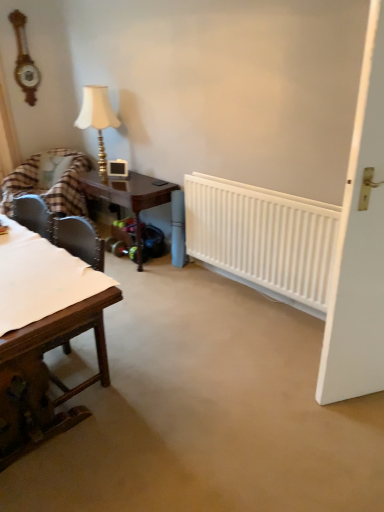
Question: Considering the relative sizes of white plastic radiator at center and plaid fabric chair at left in the image provided, is white plastic radiator at center wider than plaid fabric chair at left?

Choices:
 (A) no
 (B) yes

Answer: (A)

Question: From a real-world perspective, is white plastic radiator at center positioned under plaid fabric chair at left based on gravity?

Choices:
 (A) no
 (B) yes

Answer: (A)

Question: From the image's perspective, is white plastic radiator at center located beneath plaid fabric chair at left?

Choices:
 (A) yes
 (B) no

Answer: (A)

Question: Is white plastic radiator at center with plaid fabric chair at left?

Choices:
 (A) no
 (B) yes

Answer: (A)

Question: Does white plastic radiator at center have a lesser height compared to plaid fabric chair at left?

Choices:
 (A) no
 (B) yes

Answer: (B)

Question: Would you say wooden table at left, the 2th table when ordered from back to front, is inside or outside white matte door at right?

Choices:
 (A) inside
 (B) outside

Answer: (B)

Question: Is wooden table at left, the 1th table from the front, bigger or smaller than white matte door at right?

Choices:
 (A) big
 (B) small

Answer: (A)

Question: Is wooden table at left, the 1th table from the front, taller or shorter than white matte door at right?

Choices:
 (A) short
 (B) tall

Answer: (A)

Question: Based on their positions, is wooden table at left, the 1th table from the front, located to the left or right of white matte door at right?

Choices:
 (A) right
 (B) left

Answer: (B)

Question: Does point (100, 88) appear closer or farther from the camera than point (84, 185)?

Choices:
 (A) farther
 (B) closer

Answer: (B)

Question: Would you say matte gold table lamp at upper left is to the left or to the right of mahogany wood table at center, the first table viewed from the back, in the picture?

Choices:
 (A) right
 (B) left

Answer: (B)

Question: From the image's perspective, is matte gold table lamp at upper left positioned above or below mahogany wood table at center, the first table viewed from the back?

Choices:
 (A) above
 (B) below

Answer: (A)

Question: Is matte gold table lamp at upper left bigger or smaller than mahogany wood table at center, acting as the second table starting from the front?

Choices:
 (A) big
 (B) small

Answer: (B)

Question: In the image, is wooden clock at upper left on the left side or the right side of plaid fabric chair at left?

Choices:
 (A) right
 (B) left

Answer: (B)

Question: From the image's perspective, is wooden clock at upper left above or below plaid fabric chair at left?

Choices:
 (A) below
 (B) above

Answer: (B)